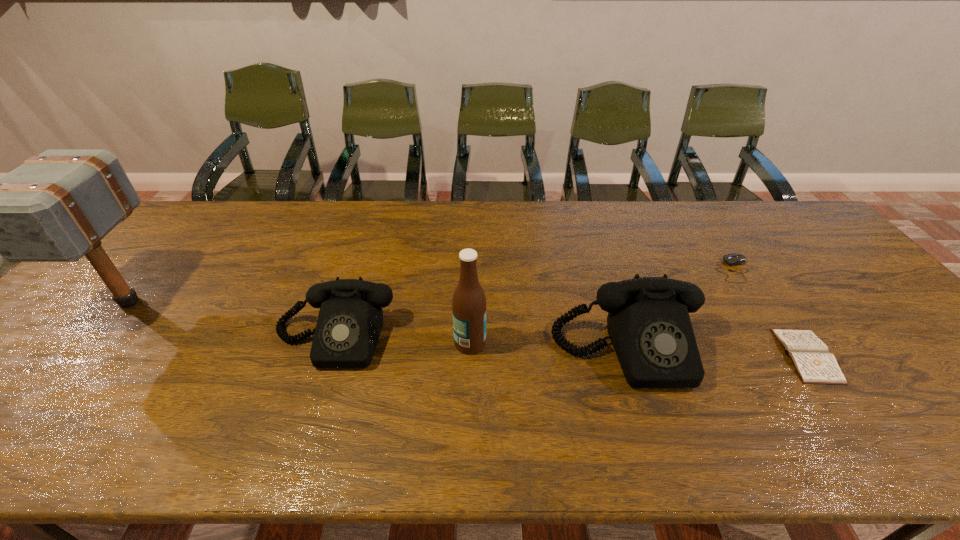
At what (x,y) coordinates should I click in order to perform the action: click on the third shortest object. Please return your answer as a coordinate pair (x, y). Looking at the image, I should click on (350, 320).

Find the location of a particular element. the left telephone is located at coordinates (350, 320).

Identify the location of the fourth object from left to right. The image size is (960, 540). (648, 322).

The width and height of the screenshot is (960, 540). Identify the location of the fourth shortest object. (648, 322).

At what (x,y) coordinates should I click in order to perform the action: click on mallet. Please return your answer as a coordinate pair (x, y). This screenshot has width=960, height=540. Looking at the image, I should click on (56, 207).

Find the location of a particular element. The image size is (960, 540). the tallest object is located at coordinates point(56,207).

Where is `the second shortest object`? the second shortest object is located at coordinates (731, 259).

What are the coordinates of `diary` in the screenshot? It's located at (811, 358).

This screenshot has height=540, width=960. Find the location of `the fifth shortest object`. the fifth shortest object is located at coordinates (469, 301).

Find the location of a particular element. beer bottle is located at coordinates (469, 301).